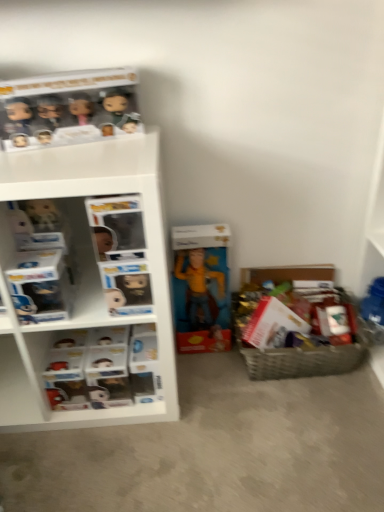
Image resolution: width=384 pixels, height=512 pixels. What do you see at coordinates (102, 368) in the screenshot?
I see `white plastic shelves at left` at bounding box center [102, 368].

Identify the location of white plastic shelf at left. Image resolution: width=384 pixels, height=512 pixels. (83, 275).

Measure the distance between white plastic shelf at left and camera.

34.54 inches.

The image size is (384, 512). What do you see at coordinates (303, 359) in the screenshot?
I see `woven brown basket at lower right` at bounding box center [303, 359].

Measure the distance between point (213, 292) and camera.

Point (213, 292) is 1.46 meters from camera.

Locate an element on the screen. white plastic shelves at left is located at coordinates (102, 368).

Does point (227, 311) come behind point (106, 339)?

Yes, point (227, 311) is farther from viewer.

From the image's perspective, does matte yellow action figure at center appear higher than white plastic shelves at left?

Yes.

How many degrees apart are the facing directions of matte yellow action figure at center and white plastic shelves at left?

0.961 degrees separate the facing orientations of matte yellow action figure at center and white plastic shelves at left.

Which is closer to the camera, (1, 392) or (49, 406)?

Point (1, 392) is positioned farther from the camera compared to point (49, 406).

Is white plastic shelf at left facing away from white plastic shelves at left?

Yes.

Looking at this image, in terms of size, does white plastic shelf at left appear bigger or smaller than white plastic shelves at left?

Considering their sizes, white plastic shelf at left takes up more space than white plastic shelves at left.

Is white plastic shelves at left positioned far away from matte black figurines at upper left?

white plastic shelves at left is near matte black figurines at upper left, not far away.

Which object is positioned more to the left, white plastic shelves at left or matte black figurines at upper left?

matte black figurines at upper left.

Can you tell me how much white plastic shelves at left and matte black figurines at upper left differ in facing direction?

13.8 degrees.

Considering the sizes of white plastic shelves at left and matte black figurines at upper left in the image, is white plastic shelves at left bigger or smaller than matte black figurines at upper left?

Clearly, white plastic shelves at left is larger in size than matte black figurines at upper left.

Are white plastic shelves at left and woven brown basket at lower right beside each other?

No.

Considering the relative positions of white plastic shelves at left and woven brown basket at lower right in the image provided, is white plastic shelves at left behind woven brown basket at lower right?

No, it is in front of woven brown basket at lower right.

Considering the sizes of objects white plastic shelves at left and woven brown basket at lower right in the image provided, who is taller, white plastic shelves at left or woven brown basket at lower right?

woven brown basket at lower right.

Between white plastic shelf at left and woven brown basket at lower right, which one has less height?

Standing shorter between the two is woven brown basket at lower right.

Which of these two, white plastic shelf at left or woven brown basket at lower right, is bigger?

white plastic shelf at left.

Is white plastic shelf at left turned away from woven brown basket at lower right?

white plastic shelf at left is not turned away from woven brown basket at lower right.

Between white plastic shelf at left and woven brown basket at lower right, which one is positioned in front?

Positioned in front is white plastic shelf at left.

In the scene shown: Considering the relative positions of matte black figurines at upper left and white plastic shelf at left in the image provided, is matte black figurines at upper left to the right of white plastic shelf at left from the viewer's perspective?

Yes, matte black figurines at upper left is to the right of white plastic shelf at left.

In terms of width, does matte black figurines at upper left look wider or thinner when compared to white plastic shelf at left?

Clearly, matte black figurines at upper left has less width compared to white plastic shelf at left.

Where is `collection positioned vertically above the white plastic shelf at left (from a real-world perspective)`? The image size is (384, 512). collection positioned vertically above the white plastic shelf at left (from a real-world perspective) is located at coordinates (68, 108).

Is point (47, 142) farther from viewer compared to point (154, 137)?

Yes, it is.

Considering the relative positions of white plastic shelf at left and matte yellow action figure at center in the image provided, is white plastic shelf at left to the left or to the right of matte yellow action figure at center?

white plastic shelf at left is positioned on matte yellow action figure at center's left side.

Can you tell me how much white plastic shelf at left and matte yellow action figure at center differ in facing direction?

0.458 degrees separate the facing orientations of white plastic shelf at left and matte yellow action figure at center.

From the image's perspective, does white plastic shelf at left appear lower than matte yellow action figure at center?

No, from the image's perspective, white plastic shelf at left is not below matte yellow action figure at center.

Is white plastic shelf at left inside the boundaries of matte yellow action figure at center, or outside?

white plastic shelf at left lies outside matte yellow action figure at center.

In order to click on toy located above the white plastic shelves at left (from the image's perspective) in this screenshot , I will do `click(199, 291)`.

Image resolution: width=384 pixels, height=512 pixels. What are the coordinates of `shelf in front of the white plastic shelves at left` in the screenshot? It's located at (83, 275).

Estimate the real-world distances between objects in this image. Which object is closer to matte yellow action figure at center, matte black figurines at upper left or woven brown basket at lower right?

Among the two, woven brown basket at lower right is located nearer to matte yellow action figure at center.

Which object lies nearer to the anchor point white plastic shelves at left, matte yellow action figure at center or white plastic shelf at left?

Based on the image, white plastic shelf at left appears to be nearer to white plastic shelves at left.

From the image, which object appears to be nearer to matte yellow action figure at center, white plastic shelf at left or matte black figurines at upper left?

The object closer to matte yellow action figure at center is white plastic shelf at left.

Consider the image. Considering their positions, is matte black figurines at upper left positioned further to white plastic shelf at left than white plastic shelves at left?

matte black figurines at upper left lies further to white plastic shelf at left than the other object.

From the picture: Looking at the image, which one is located further to white plastic shelf at left, matte black figurines at upper left or matte yellow action figure at center?

The object further to white plastic shelf at left is matte yellow action figure at center.

Estimate the real-world distances between objects in this image. Which object is further from matte black figurines at upper left, white plastic shelf at left or woven brown basket at lower right?

woven brown basket at lower right is positioned further to the anchor matte black figurines at upper left.

Estimate the real-world distances between objects in this image. Which object is closer to matte black figurines at upper left, matte yellow action figure at center or woven brown basket at lower right?

The object closer to matte black figurines at upper left is matte yellow action figure at center.

From the image, which object appears to be nearer to woven brown basket at lower right, matte yellow action figure at center or white plastic shelf at left?

matte yellow action figure at center lies closer to woven brown basket at lower right than the other object.

Identify the location of basket between matte black figurines at upper left and white plastic shelves at left vertically. This screenshot has width=384, height=512. (303, 359).

Image resolution: width=384 pixels, height=512 pixels. Find the location of `cabinet situated between white plastic shelf at left and matte yellow action figure at center from left to right`. cabinet situated between white plastic shelf at left and matte yellow action figure at center from left to right is located at coordinates 102,368.

At what (x,y) coordinates should I click in order to perform the action: click on toy between white plastic shelf at left and woven brown basket at lower right from left to right. Please return your answer as a coordinate pair (x, y). Looking at the image, I should click on (199, 291).

At what (x,y) coordinates should I click in order to perform the action: click on toy between matte black figurines at upper left and woven brown basket at lower right. Please return your answer as a coordinate pair (x, y). This screenshot has height=512, width=384. Looking at the image, I should click on (199, 291).